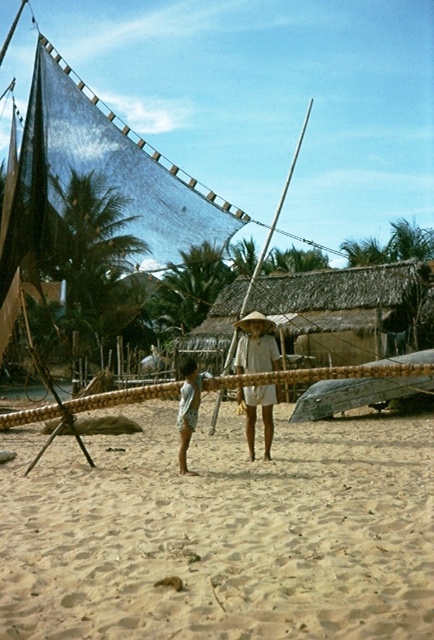
You are standing on the beach and want to pick up the light blue cotton shorts at center. Are the light beige sand at center in your way?

The light beige sand at center is closer to the viewer than the light blue cotton shorts at center, so yes, the sand is in your way when trying to reach the shorts.

You are a photographer positioned at the edge of the beach scene. You want to take a photo focusing on the light blue cotton shorts at center without the white woven hat at center appearing in the foreground. Is this possible given their positions?

The white woven hat at center is further to the viewer than the light blue cotton shorts at center, so it will appear in the foreground. To avoid the hat blocking the shorts in the photo, you would need to adjust your angle or move the subjects so the hat is not between you and the shorts.

You are a photographer at the beach scene described. You want to capture a photo where the light blue cotton shorts at center are clearly visible against the light beige sand at center. Based on their positions, will the shorts be easy to see in the photo?

The light beige sand at center is below light blue cotton shorts at center, so yes, the shorts will be easy to see as they are positioned above the sand and their color contrasts with it.